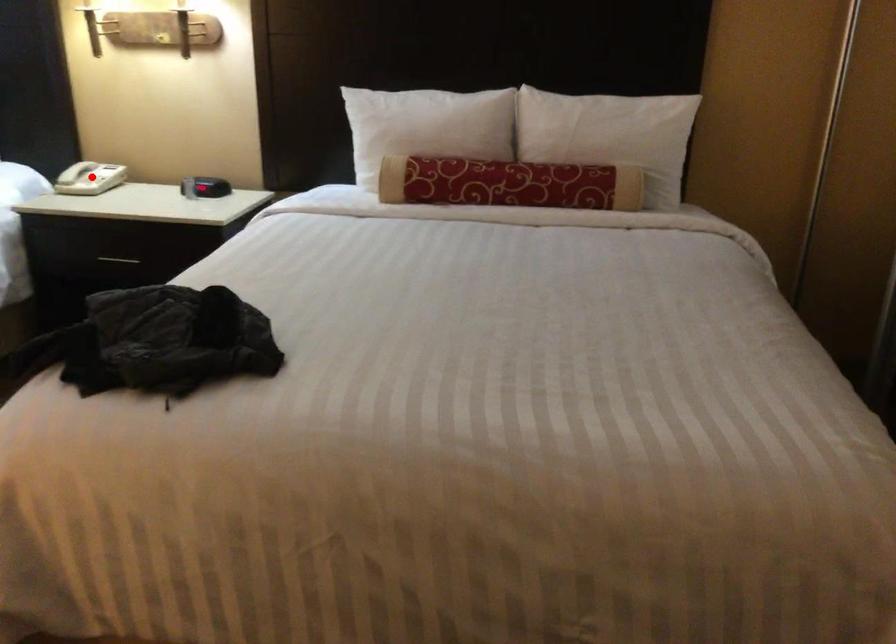
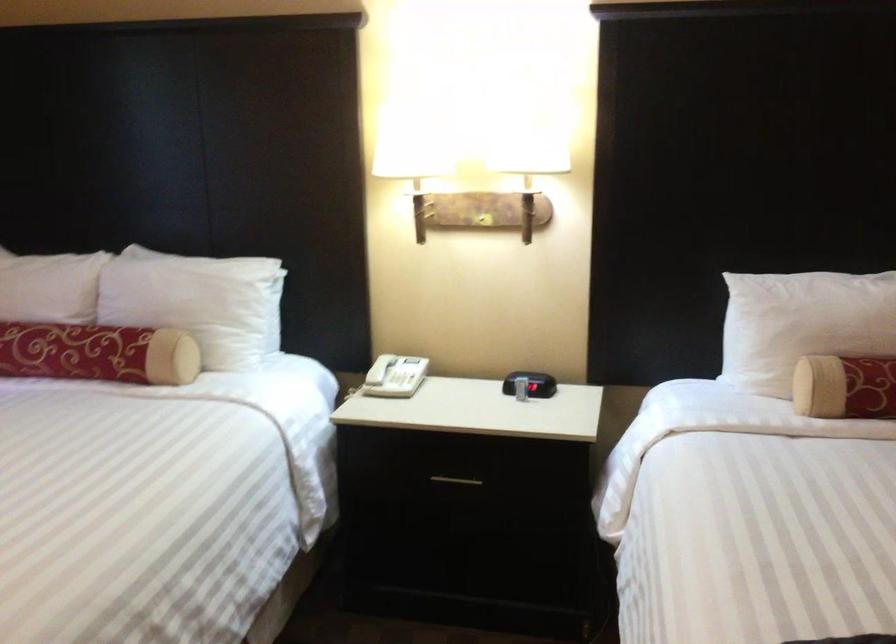
Locate, in the second image, the point that corresponds to the highlighted location in the first image.

(405, 380)